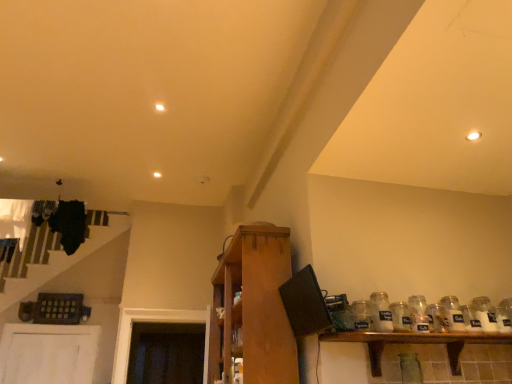
Find the location of a particular element. This screenshot has height=384, width=512. vacant space positioned to the left of clear glass jar at shelf right, which is the 4th glass jar in right-to-left order is located at coordinates (336, 333).